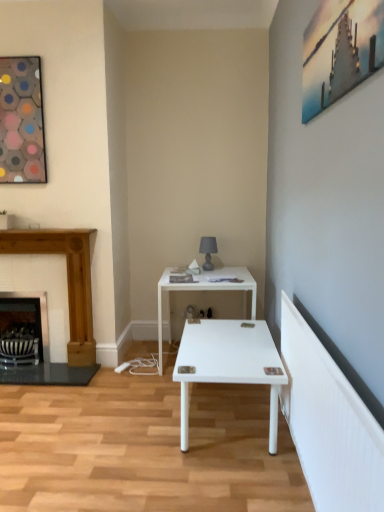
Describe the element at coordinates (23, 329) in the screenshot. The width and height of the screenshot is (384, 512). I see `black metal fireplace at left, the 1th fireplace when ordered from left to right` at that location.

This screenshot has width=384, height=512. What are the coordinates of `metallic silver swivel chair at lower left` in the screenshot? It's located at (19, 348).

At what (x,y) coordinates should I click in order to perform the action: click on black metal fireplace at left, the 1th fireplace when ordered from left to right. Please return your answer as a coordinate pair (x, y). This screenshot has height=512, width=384. Looking at the image, I should click on (23, 329).

Is black metal fireplace at left, the 2th fireplace from the right, inside the boundaries of hexagonal mosaic art at upper left, which appears as the 2th picture frame when viewed from the front, or outside?

black metal fireplace at left, the 2th fireplace from the right, is spatially situated outside hexagonal mosaic art at upper left, which appears as the 2th picture frame when viewed from the front.

Is the position of black metal fireplace at left, the 2th fireplace from the right, less distant than that of hexagonal mosaic art at upper left, the first picture frame viewed from the back?

No, it is not.

Does black metal fireplace at left, the 1th fireplace when ordered from left to right, touch hexagonal mosaic art at upper left, the 1th picture frame viewed from the left?

A: No, black metal fireplace at left, the 1th fireplace when ordered from left to right, is not touching hexagonal mosaic art at upper left, the 1th picture frame viewed from the left.

From the image's perspective, is metallic silver picture frame at upper right, the second picture frame in the back-to-front sequence, located beneath wooden fireplace at left, which ranks as the 1th fireplace in right-to-left order?

No, from the image's perspective, metallic silver picture frame at upper right, the second picture frame in the back-to-front sequence, is not below wooden fireplace at left, which ranks as the 1th fireplace in right-to-left order.

Is point (366, 55) closer or farther from the camera than point (75, 288)?

Clearly, point (366, 55) is closer to the camera than point (75, 288).

Between metallic silver picture frame at upper right, the first picture frame positioned from the right, and wooden fireplace at left, which appears as the second fireplace when viewed from the left, which one has smaller width?

With smaller width is metallic silver picture frame at upper right, the first picture frame positioned from the right.

From a real-world perspective, is hexagonal mosaic art at upper left, the first picture frame viewed from the back, on top of black metal fireplace at left, the 1th fireplace when ordered from left to right?

Yes, from a real-world perspective, hexagonal mosaic art at upper left, the first picture frame viewed from the back, is on top of black metal fireplace at left, the 1th fireplace when ordered from left to right.

Considering the relative sizes of hexagonal mosaic art at upper left, the first picture frame viewed from the back, and black metal fireplace at left, the 2th fireplace from the right, in the image provided, is hexagonal mosaic art at upper left, the first picture frame viewed from the back, smaller than black metal fireplace at left, the 2th fireplace from the right,?

Correct, hexagonal mosaic art at upper left, the first picture frame viewed from the back, occupies less space than black metal fireplace at left, the 2th fireplace from the right.

Can you tell me how much hexagonal mosaic art at upper left, the first picture frame viewed from the back, and black metal fireplace at left, the 1th fireplace when ordered from left to right, differ in facing direction?

The facing directions of hexagonal mosaic art at upper left, the first picture frame viewed from the back, and black metal fireplace at left, the 1th fireplace when ordered from left to right, are 0.699 degrees apart.

Is point (15, 73) closer to viewer compared to point (16, 321)?

Yes.

Is black metal fireplace at left, the 1th fireplace when ordered from left to right, next to metallic silver swivel chair at lower left?

Yes, black metal fireplace at left, the 1th fireplace when ordered from left to right, and metallic silver swivel chair at lower left clearly make contact.

Which object is further away from the camera, black metal fireplace at left, the 2th fireplace from the right, or metallic silver swivel chair at lower left?

Positioned behind is black metal fireplace at left, the 2th fireplace from the right.

How many degrees apart are the facing directions of black metal fireplace at left, the 1th fireplace when ordered from left to right, and metallic silver swivel chair at lower left?

black metal fireplace at left, the 1th fireplace when ordered from left to right, and metallic silver swivel chair at lower left are facing 0.751 degrees away from each other.

Is black metal fireplace at left, the 1th fireplace when ordered from left to right, taller than metallic silver swivel chair at lower left?

Indeed, black metal fireplace at left, the 1th fireplace when ordered from left to right, has a greater height compared to metallic silver swivel chair at lower left.

Is there a large distance between black metal fireplace at left, the 2th fireplace from the right, and wooden fireplace at left, which ranks as the 1th fireplace in right-to-left order?

No, black metal fireplace at left, the 2th fireplace from the right, is in close proximity to wooden fireplace at left, which ranks as the 1th fireplace in right-to-left order.

Relative to wooden fireplace at left, which ranks as the 1th fireplace in right-to-left order, is black metal fireplace at left, the 1th fireplace when ordered from left to right, in front or behind?

In the image, black metal fireplace at left, the 1th fireplace when ordered from left to right, appears behind wooden fireplace at left, which ranks as the 1th fireplace in right-to-left order.

Is black metal fireplace at left, the 1th fireplace when ordered from left to right, wider than wooden fireplace at left, which ranks as the 1th fireplace in right-to-left order?

Incorrect, the width of black metal fireplace at left, the 1th fireplace when ordered from left to right, does not surpass that of wooden fireplace at left, which ranks as the 1th fireplace in right-to-left order.

Looking at this image, would you say wooden fireplace at left, which ranks as the 1th fireplace in right-to-left order, is part of black metal fireplace at left, the 2th fireplace from the right,'s contents?

Actually, wooden fireplace at left, which ranks as the 1th fireplace in right-to-left order, is outside black metal fireplace at left, the 2th fireplace from the right.

From a real-world perspective, does hexagonal mosaic art at upper left, which appears as the 2th picture frame when viewed from the front, stand above wooden fireplace at left, which appears as the second fireplace when viewed from the left?

Yes, from a real-world perspective, hexagonal mosaic art at upper left, which appears as the 2th picture frame when viewed from the front, is on top of wooden fireplace at left, which appears as the second fireplace when viewed from the left.

Are hexagonal mosaic art at upper left, which appears as the 2th picture frame when viewed from the front, and wooden fireplace at left, which ranks as the 1th fireplace in right-to-left order, far apart?

Actually, hexagonal mosaic art at upper left, which appears as the 2th picture frame when viewed from the front, and wooden fireplace at left, which ranks as the 1th fireplace in right-to-left order, are a little close together.

Is point (22, 154) closer to viewer compared to point (86, 274)?

That is True.

Consider the image. Which is more to the right, hexagonal mosaic art at upper left, the 1th picture frame viewed from the left, or wooden fireplace at left, which appears as the second fireplace when viewed from the left?

From the viewer's perspective, wooden fireplace at left, which appears as the second fireplace when viewed from the left, appears more on the right side.

Measure the distance between metallic silver picture frame at upper right, the second picture frame in the back-to-front sequence, and hexagonal mosaic art at upper left, the first picture frame viewed from the back.

metallic silver picture frame at upper right, the second picture frame in the back-to-front sequence, and hexagonal mosaic art at upper left, the first picture frame viewed from the back, are 7.55 feet apart.

In the scene shown: Are metallic silver picture frame at upper right, the 2th picture frame when ordered from left to right, and hexagonal mosaic art at upper left, the 1th picture frame viewed from the left, far apart?

Indeed, metallic silver picture frame at upper right, the 2th picture frame when ordered from left to right, is not near hexagonal mosaic art at upper left, the 1th picture frame viewed from the left.

Is metallic silver picture frame at upper right, the first picture frame positioned from the right, at the right side of hexagonal mosaic art at upper left, the 1th picture frame viewed from the left?

Yes, metallic silver picture frame at upper right, the first picture frame positioned from the right, is to the right of hexagonal mosaic art at upper left, the 1th picture frame viewed from the left.

Is metallic silver picture frame at upper right, the second picture frame in the back-to-front sequence, positioned with its back to hexagonal mosaic art at upper left, the first picture frame viewed from the back?

metallic silver picture frame at upper right, the second picture frame in the back-to-front sequence, is not turned away from hexagonal mosaic art at upper left, the first picture frame viewed from the back.

From the black metal fireplace at left, the 1th fireplace when ordered from left to right, count 1st picture frames forward and point to it. Please provide its 2D coordinates.

[(21, 121)]

This screenshot has width=384, height=512. In order to click on picture frame located on the right of wooden fireplace at left, which ranks as the 1th fireplace in right-to-left order in this screenshot , I will do `click(340, 51)`.

Looking at the image, which one is located further to metallic silver swivel chair at lower left, wooden fireplace at left, which ranks as the 1th fireplace in right-to-left order, or hexagonal mosaic art at upper left, the 1th picture frame viewed from the left?

The object further to metallic silver swivel chair at lower left is hexagonal mosaic art at upper left, the 1th picture frame viewed from the left.

Consider the image. Looking at the image, which one is located closer to hexagonal mosaic art at upper left, the 1th picture frame viewed from the left, metallic silver picture frame at upper right, the second picture frame in the back-to-front sequence, or metallic silver swivel chair at lower left?

Based on the image, metallic silver swivel chair at lower left appears to be nearer to hexagonal mosaic art at upper left, the 1th picture frame viewed from the left.

Which object lies further to the anchor point matte gray glass table lamp at center, white glossy table at center or wooden fireplace at left, which ranks as the 1th fireplace in right-to-left order?

wooden fireplace at left, which ranks as the 1th fireplace in right-to-left order, is further to matte gray glass table lamp at center.

Based on their spatial positions, is metallic silver swivel chair at lower left or metallic silver picture frame at upper right, the 2th picture frame when ordered from left to right, further from white glossy table at center?

metallic silver picture frame at upper right, the 2th picture frame when ordered from left to right, is further to white glossy table at center.

Estimate the real-world distances between objects in this image. Which object is closer to white glossy table at center, black metal fireplace at left, the 2th fireplace from the right, or matte gray glass table lamp at center?

matte gray glass table lamp at center lies closer to white glossy table at center than the other object.

From the picture: Considering their positions, is hexagonal mosaic art at upper left, the 1th picture frame viewed from the left, positioned further to white glossy table at center than metallic silver picture frame at upper right, which is counted as the first picture frame, starting from the front?

metallic silver picture frame at upper right, which is counted as the first picture frame, starting from the front.

Which object lies nearer to the anchor point metallic silver swivel chair at lower left, black metal fireplace at left, the 2th fireplace from the right, or matte gray glass table lamp at center?

black metal fireplace at left, the 2th fireplace from the right.

Estimate the real-world distances between objects in this image. Which object is further from wooden fireplace at left, which ranks as the 1th fireplace in right-to-left order, white glossy table at center or metallic silver swivel chair at lower left?

white glossy table at center is further to wooden fireplace at left, which ranks as the 1th fireplace in right-to-left order.

Locate an element on the screen. Image resolution: width=384 pixels, height=512 pixels. swivel chair between metallic silver picture frame at upper right, the second picture frame in the back-to-front sequence, and black metal fireplace at left, the 1th fireplace when ordered from left to right, from front to back is located at coordinates (19, 348).

Where is `fireplace between metallic silver picture frame at upper right, the 2th picture frame when ordered from left to right, and black metal fireplace at left, the 1th fireplace when ordered from left to right, in the front-back direction`? This screenshot has width=384, height=512. fireplace between metallic silver picture frame at upper right, the 2th picture frame when ordered from left to right, and black metal fireplace at left, the 1th fireplace when ordered from left to right, in the front-back direction is located at coordinates (67, 280).

Where is `table between metallic silver picture frame at upper right, the first picture frame positioned from the right, and metallic silver swivel chair at lower left from front to back`? The height and width of the screenshot is (512, 384). table between metallic silver picture frame at upper right, the first picture frame positioned from the right, and metallic silver swivel chair at lower left from front to back is located at coordinates (205, 291).

Where is `fireplace between hexagonal mosaic art at upper left, the 1th picture frame viewed from the left, and black metal fireplace at left, the 2th fireplace from the right, in the vertical direction`? This screenshot has width=384, height=512. fireplace between hexagonal mosaic art at upper left, the 1th picture frame viewed from the left, and black metal fireplace at left, the 2th fireplace from the right, in the vertical direction is located at coordinates (67, 280).